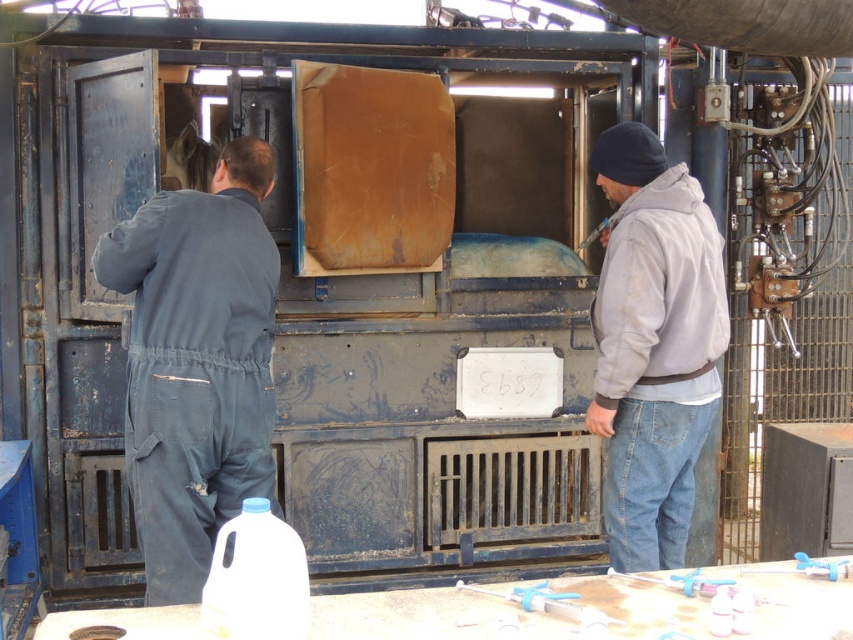
Between dark grey coveralls at left and white plastic bottle at lower left, which one appears on the right side from the viewer's perspective?

white plastic bottle at lower left

Which of these two, dark grey coveralls at left or white plastic bottle at lower left, stands taller?

dark grey coveralls at left is taller.

Find the location of a particular element. The image size is (853, 640). dark grey coveralls at left is located at coordinates (196, 362).

Between point (149, 380) and point (624, 445), which one is positioned behind?

The point (624, 445) is more distant.

Between dark grey coveralls at left and gray fleece jacket at right, which one appears on the right side from the viewer's perspective?

gray fleece jacket at right is more to the right.

You are a GUI agent. You are given a task and a screenshot of the screen. Output one action in this format:
    pyautogui.click(x=<x>, y=<y>)
    Task: Click on the dark grey coveralls at left
    The height and width of the screenshot is (640, 853).
    Given the screenshot: What is the action you would take?
    pyautogui.click(x=196, y=362)

Is point (654, 435) closer to viewer compared to point (225, 609)?

No, it is not.

Between point (685, 332) and point (230, 566), which one is positioned behind?

The point (685, 332) is more distant.

Measure the distance between gray fleece jacket at right and camera.

A distance of 4.15 meters exists between gray fleece jacket at right and camera.

Image resolution: width=853 pixels, height=640 pixels. What are the coordinates of `gray fleece jacket at right` in the screenshot? It's located at (653, 346).